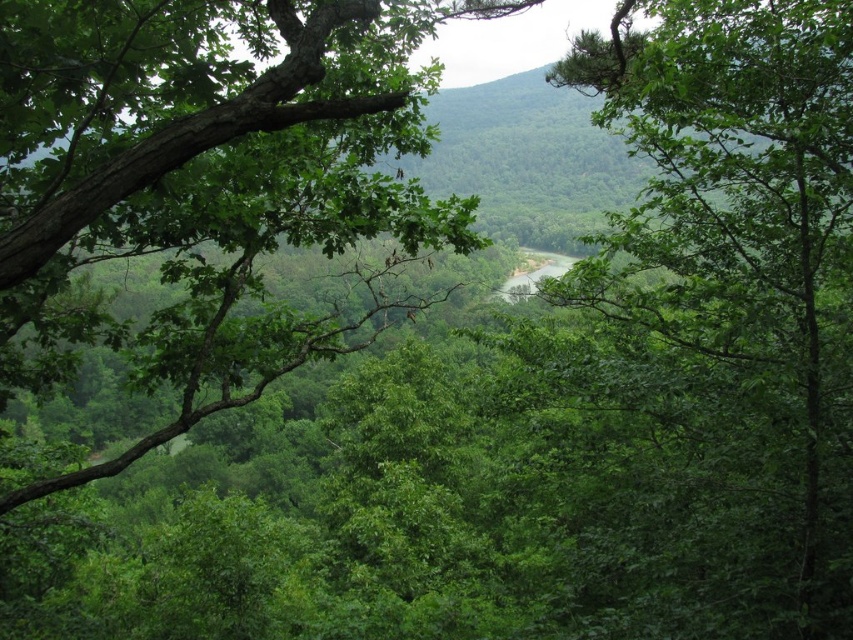
You are a hiker who wants to take a photo of the green rough bark tree at left without the green leafy tree at center blocking the view. What should you do?

Move to a position where the green rough bark tree at left is no longer behind the green leafy tree at center. Since the green rough bark tree at left is behind the green leafy tree at center, moving to the side or further back might allow you to frame the shot without obstruction.

You are a hiker who wants to cross the river using a fallen tree trunk. You have two options in the scene. Which tree would you choose to cross the river safely? The green leafy tree at center or the green rough bark tree at left?

The green rough bark tree at left is wider than the green leafy tree at center, so it would provide a more stable and safer crossing.

You are standing at the center of the forest and want to locate the green leafy tree at center. Which direction should you look to find it?

The green leafy tree at center is located at point coordinates (727, 308), so you should look towards the upper part of the forest since the y coordinate 0.853 is closer to 1.0 which is the top of the image.